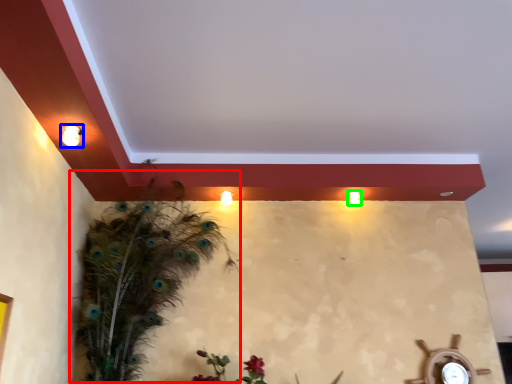
Question: Estimate the real-world distances between objects in this image. Which object is closer to bird (highlighted by a red box), light fixture (highlighted by a blue box) or light (highlighted by a green box)?

Choices:
 (A) light fixture
 (B) light

Answer: (A)